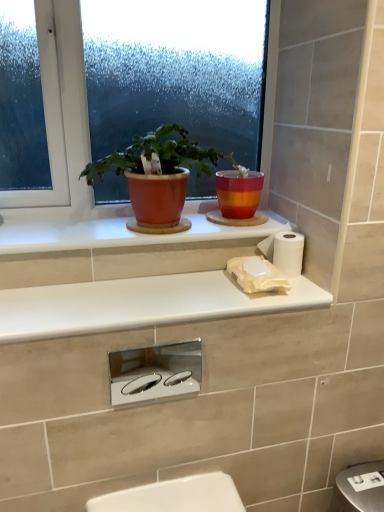
Question: Considering the relative sizes of chrome/polished flush plate at center and white ceramic window sill at upper center, the first window sill when ordered from top to bottom, in the image provided, is chrome/polished flush plate at center shorter than white ceramic window sill at upper center, the first window sill when ordered from top to bottom,?

Choices:
 (A) no
 (B) yes

Answer: (A)

Question: Is chrome/polished flush plate at center facing towards white ceramic window sill at upper center, which ranks as the 2th window sill in bottom-to-top order?

Choices:
 (A) yes
 (B) no

Answer: (B)

Question: From the image's perspective, is chrome/polished flush plate at center on top of white ceramic window sill at upper center, the first window sill when ordered from top to bottom?

Choices:
 (A) no
 (B) yes

Answer: (A)

Question: From a real-world perspective, is chrome/polished flush plate at center physically below white ceramic window sill at upper center, the first window sill when ordered from top to bottom?

Choices:
 (A) no
 (B) yes

Answer: (B)

Question: Does chrome/polished flush plate at center have a lesser width compared to white ceramic window sill at upper center, which ranks as the 2th window sill in bottom-to-top order?

Choices:
 (A) yes
 (B) no

Answer: (A)

Question: Considering the relative positions of chrome/polished flush plate at center and white ceramic window sill at upper center, the first window sill when ordered from top to bottom, in the image provided, is chrome/polished flush plate at center to the right of white ceramic window sill at upper center, the first window sill when ordered from top to bottom, from the viewer's perspective?

Choices:
 (A) no
 (B) yes

Answer: (B)

Question: Is white ceramic window sill at upper center, the first window sill when ordered from top to bottom, at the right side of matte orange pot at upper center?

Choices:
 (A) yes
 (B) no

Answer: (B)

Question: Does white ceramic window sill at upper center, which ranks as the 2th window sill in bottom-to-top order, touch matte orange pot at upper center?

Choices:
 (A) no
 (B) yes

Answer: (A)

Question: From the image's perspective, is white ceramic window sill at upper center, which ranks as the 2th window sill in bottom-to-top order, beneath matte orange pot at upper center?

Choices:
 (A) yes
 (B) no

Answer: (A)

Question: From the image's perspective, would you say white ceramic window sill at upper center, which ranks as the 2th window sill in bottom-to-top order, is positioned over matte orange pot at upper center?

Choices:
 (A) yes
 (B) no

Answer: (B)

Question: Is white ceramic window sill at upper center, which ranks as the 2th window sill in bottom-to-top order, facing away from matte orange pot at upper center?

Choices:
 (A) no
 (B) yes

Answer: (A)

Question: Does white ceramic window sill at upper center, the first window sill when ordered from top to bottom, have a lesser height compared to matte orange pot at upper center?

Choices:
 (A) no
 (B) yes

Answer: (B)

Question: Could matte glass window at upper center be considered to be inside white glossy countertop at upper center, which is the first window sill in bottom-to-top order?

Choices:
 (A) no
 (B) yes

Answer: (A)